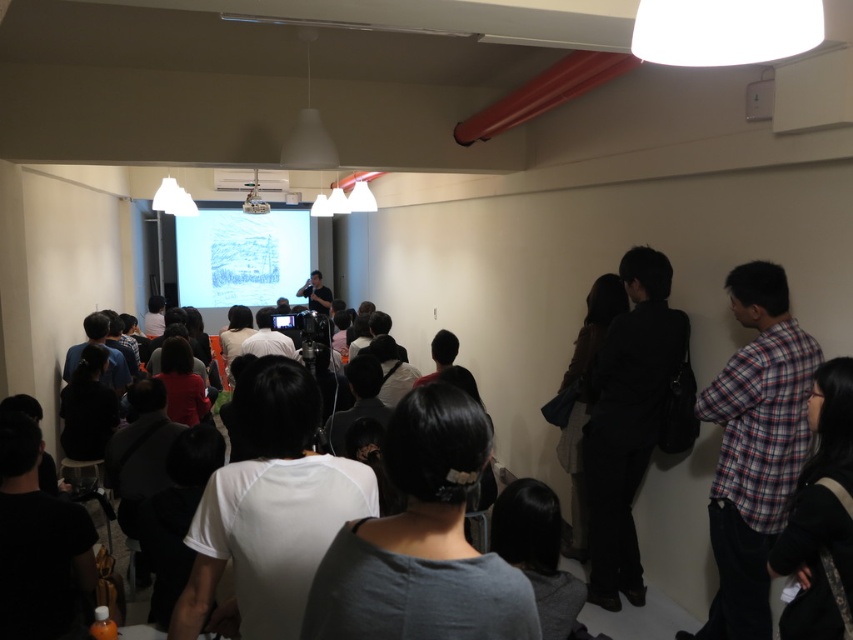
Question: Does plaid fabric shirt at right appear over black fabric bag at right?

Choices:
 (A) yes
 (B) no

Answer: (B)

Question: Among these objects, which one is nearest to the camera?

Choices:
 (A) black fabric bag at right
 (B) plaid fabric shirt at right

Answer: (B)

Question: Does plaid fabric shirt at right appear under black fabric bag at right?

Choices:
 (A) no
 (B) yes

Answer: (B)

Question: Is plaid fabric shirt at right below black fabric bag at right?

Choices:
 (A) no
 (B) yes

Answer: (B)